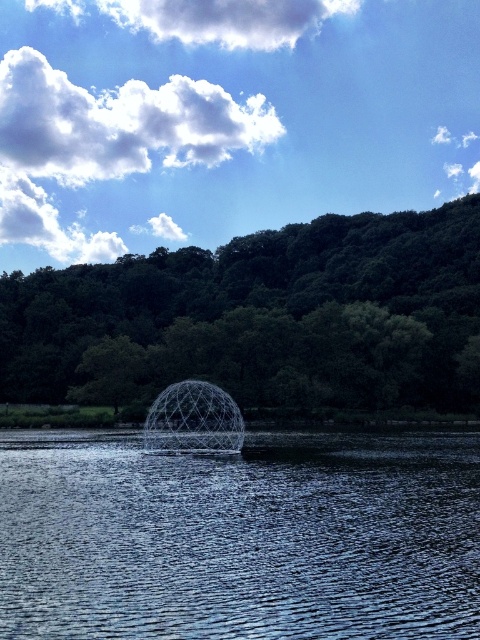
Question: From the image, what is the correct spatial relationship of glistening blue water at center in relation to green leafy tree at center?

Choices:
 (A) above
 (B) below

Answer: (B)

Question: Considering the relative positions of glistening blue water at center and green leafy tree at center in the image provided, where is glistening blue water at center located with respect to green leafy tree at center?

Choices:
 (A) right
 (B) left

Answer: (B)

Question: Which point is closer to the camera taking this photo?

Choices:
 (A) (228, 529)
 (B) (384, 262)

Answer: (A)

Question: Is glistening blue water at center below green leafy tree at center?

Choices:
 (A) yes
 (B) no

Answer: (A)

Question: Which point appears closest to the camera in this image?

Choices:
 (A) (112, 548)
 (B) (370, 280)

Answer: (A)

Question: Which object appears closest to the camera in this image?

Choices:
 (A) green leafy tree at center
 (B) glistening blue water at center

Answer: (B)